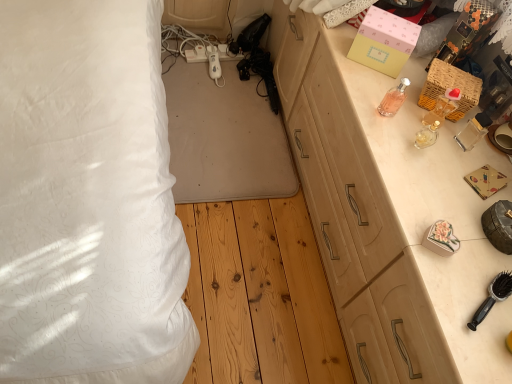
Locate an element on the screen. This screenshot has height=384, width=512. free location in front of clear glass perfume at upper right, marked as the 3th perfume in a left-to-right arrangement is located at coordinates (423, 161).